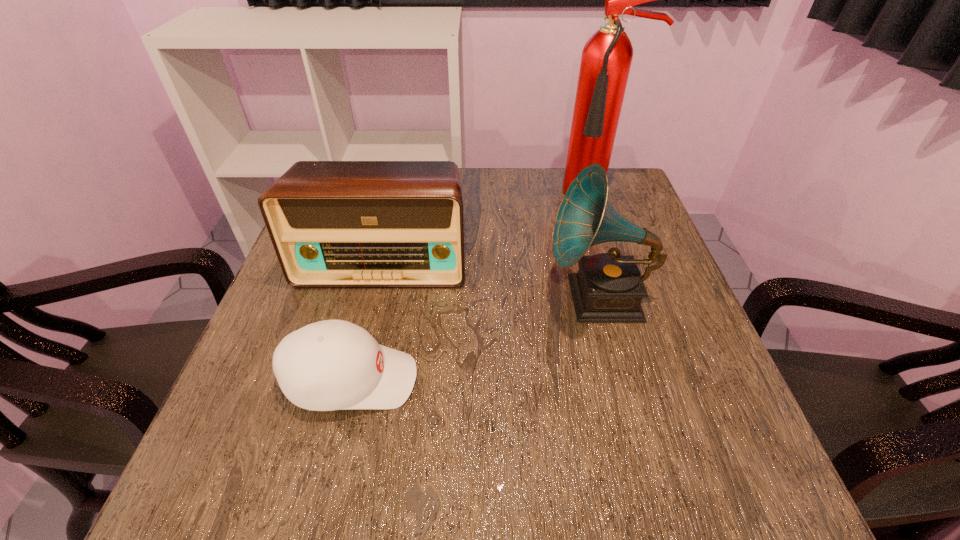
Where is `blank space located on the front-facing side of the radio receiver`? The height and width of the screenshot is (540, 960). blank space located on the front-facing side of the radio receiver is located at coordinates click(355, 380).

What are the coordinates of `vacant region located on the front-facing side of the shortest object` in the screenshot? It's located at (512, 380).

This screenshot has height=540, width=960. Identify the location of object that is at the far edge. (606, 59).

Find the location of a particular element. The width and height of the screenshot is (960, 540). radio receiver that is at the left edge is located at coordinates (332, 223).

Locate an element on the screen. baseball cap at the left edge is located at coordinates (329, 365).

Identify the location of fire extinguisher that is at the right edge. (606, 59).

At what (x,y) coordinates should I click in order to perform the action: click on phonograph_record located in the right edge section of the desktop. Please return your answer as a coordinate pair (x, y). The image size is (960, 540). Looking at the image, I should click on (608, 287).

Where is `object at the far right corner`? The height and width of the screenshot is (540, 960). object at the far right corner is located at coordinates (606, 59).

In order to click on free region at the far edge of the desktop in this screenshot , I will do `click(523, 176)`.

In the image, there is a desktop. Where is `vacant space at the near edge`? vacant space at the near edge is located at coordinates (599, 474).